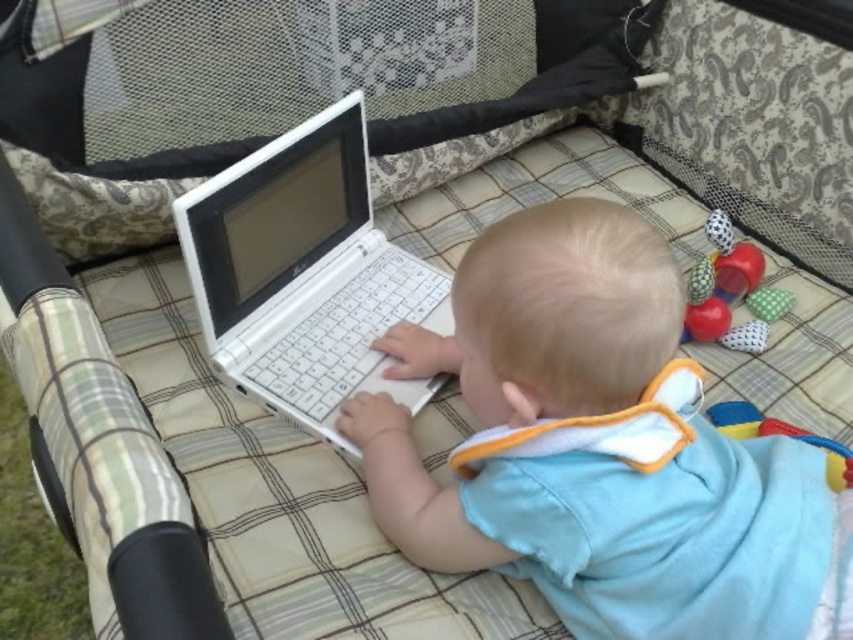
Locate an element on the screen. white plastic laptop at center is located at coordinates (305, 273).

This screenshot has width=853, height=640. What do you see at coordinates (305, 273) in the screenshot?
I see `white plastic laptop at center` at bounding box center [305, 273].

Find the location of `white plastic laptop at center`. white plastic laptop at center is located at coordinates (305, 273).

Does light blue fabric baby at center appear over white plastic laptop at center?

Actually, light blue fabric baby at center is below white plastic laptop at center.

This screenshot has width=853, height=640. Describe the element at coordinates (601, 449) in the screenshot. I see `light blue fabric baby at center` at that location.

I want to click on light blue fabric baby at center, so click(601, 449).

Who is more forward, (506, 556) or (749, 256)?

Point (506, 556)

The image size is (853, 640). Identify the location of light blue fabric baby at center. (601, 449).